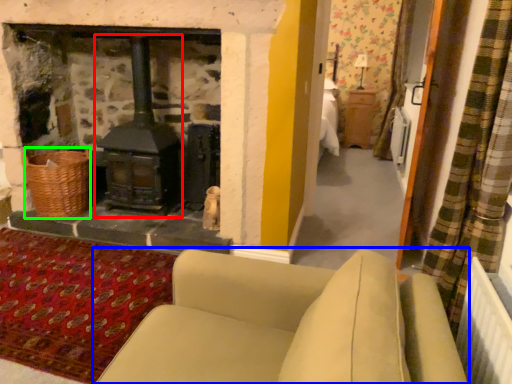
Question: Which object is positioned closest to wood burning stove (highlighted by a red box)? Select from studio couch (highlighted by a blue box) and basket (highlighted by a green box).

Choices:
 (A) studio couch
 (B) basket

Answer: (B)